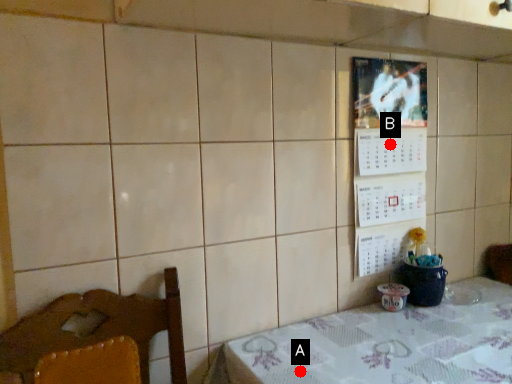
Question: Two points are circled on the image, labeled by A and B beside each circle. Which point appears closest to the camera in this image?

Choices:
 (A) A is closer
 (B) B is closer

Answer: (A)